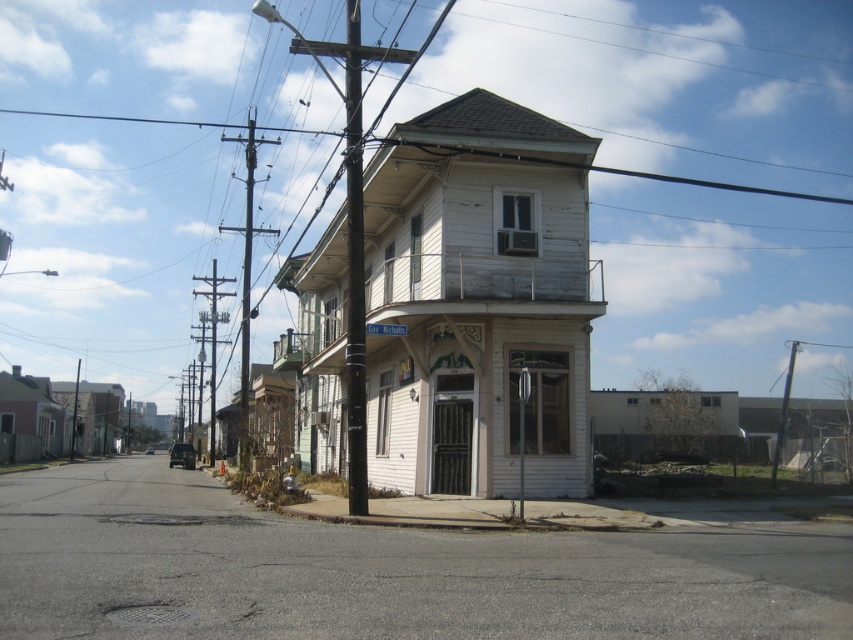
Question: From the image, what is the correct spatial relationship of black painted wood utility pole at center in relation to metallic utility pole at center-left?

Choices:
 (A) right
 (B) left

Answer: (A)

Question: Which of the following is the farthest from the observer?

Choices:
 (A) metallic utility pole at center-left
 (B) black painted wood utility pole at center

Answer: (A)

Question: Is black painted wood utility pole at center closer to camera compared to metallic utility pole at center-left?

Choices:
 (A) yes
 (B) no

Answer: (A)

Question: Can you confirm if black painted wood utility pole at center is positioned below metallic utility pole at center-left?

Choices:
 (A) no
 (B) yes

Answer: (A)

Question: Which of the following is the farthest from the observer?

Choices:
 (A) black painted wood utility pole at center
 (B) metallic utility pole at center-left

Answer: (B)